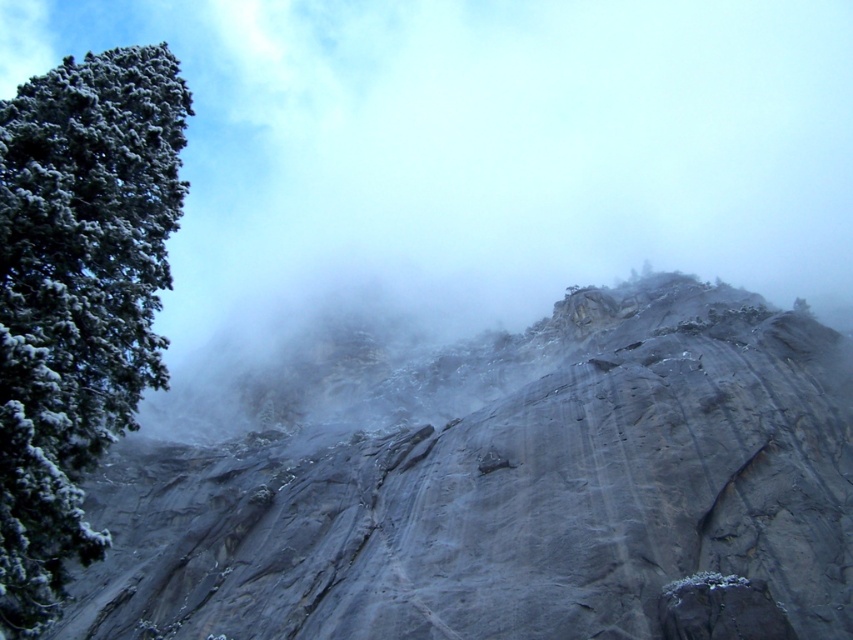
Question: Which point is closer to the camera taking this photo?

Choices:
 (A) pyautogui.click(x=810, y=595)
 (B) pyautogui.click(x=103, y=545)

Answer: (B)

Question: Can you confirm if gray rough rock at center is bigger than green textured tree at left?

Choices:
 (A) yes
 (B) no

Answer: (A)

Question: Is gray rough rock at center thinner than green textured tree at left?

Choices:
 (A) no
 (B) yes

Answer: (A)

Question: Which object is closer to the camera taking this photo?

Choices:
 (A) green textured tree at left
 (B) gray rough rock at center

Answer: (A)

Question: Is gray rough rock at center below green textured tree at left?

Choices:
 (A) yes
 (B) no

Answer: (A)